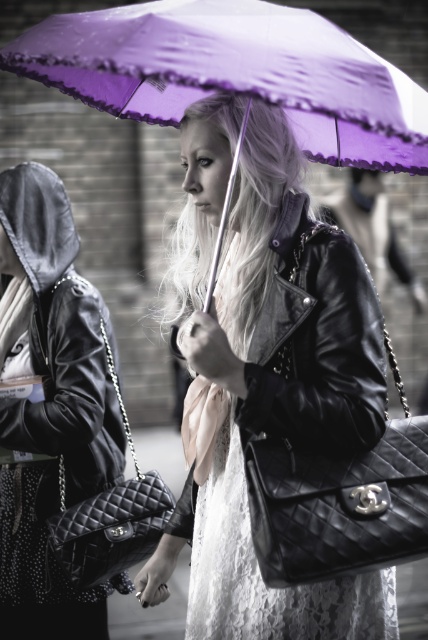
Is black quilted leather handbag at center positioned in front of purple satin umbrella at center?

That is False.

Between point (385, 621) and point (56, 68), which one is positioned behind?

The point (56, 68) is more distant.

Locate an element on the screen. The width and height of the screenshot is (428, 640). black quilted leather handbag at center is located at coordinates (264, 381).

Can you confirm if purple satin umbrella at center is wider than black quilted leather handbag at left?

Indeed, purple satin umbrella at center has a greater width compared to black quilted leather handbag at left.

Does purple satin umbrella at center lie behind black quilted leather handbag at left?

No, it is in front of black quilted leather handbag at left.

Is point (68, 35) positioned behind point (65, 228)?

No, it is not.

Find the location of a particular element. The image size is (428, 640). purple satin umbrella at center is located at coordinates (234, 72).

Which is below, black quilted leather handbag at center or black quilted leather handbag at left?

black quilted leather handbag at left is below.

This screenshot has width=428, height=640. Describe the element at coordinates (264, 381) in the screenshot. I see `black quilted leather handbag at center` at that location.

Identify the location of black quilted leather handbag at center. Image resolution: width=428 pixels, height=640 pixels. (264, 381).